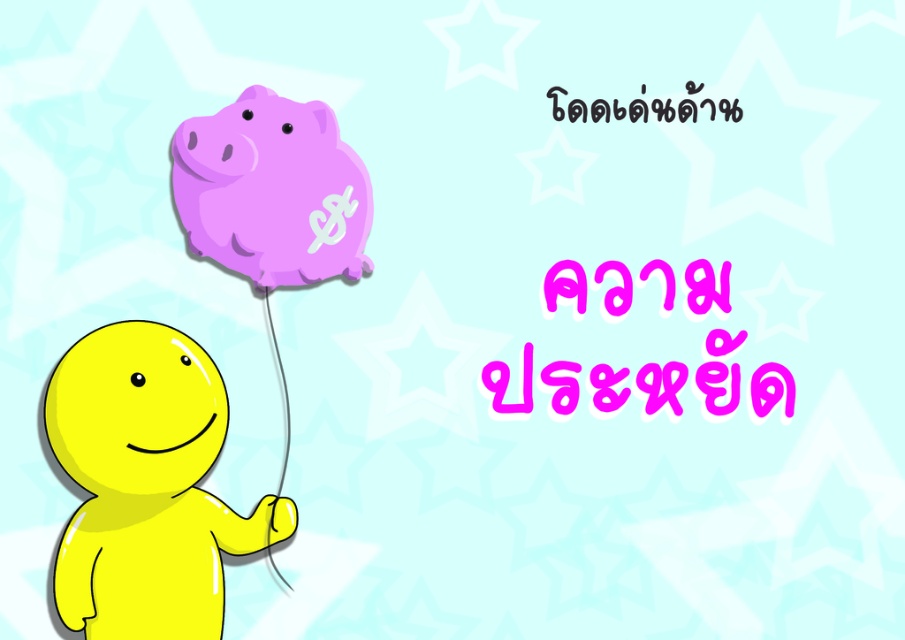
Based on the coordinates provided, where exactly is the matte purple piggy bank at upper center located in the image?

The matte purple piggy bank at upper center is located at coordinates point (x=272, y=189).

You are a treasure hunter who just found a hidden treasure map. The map has a coordinate point marked as point (272, 189). According to the scene description, what object is located at this coordinate point?

The point (272, 189) marks the matte purple piggy bank at upper center.